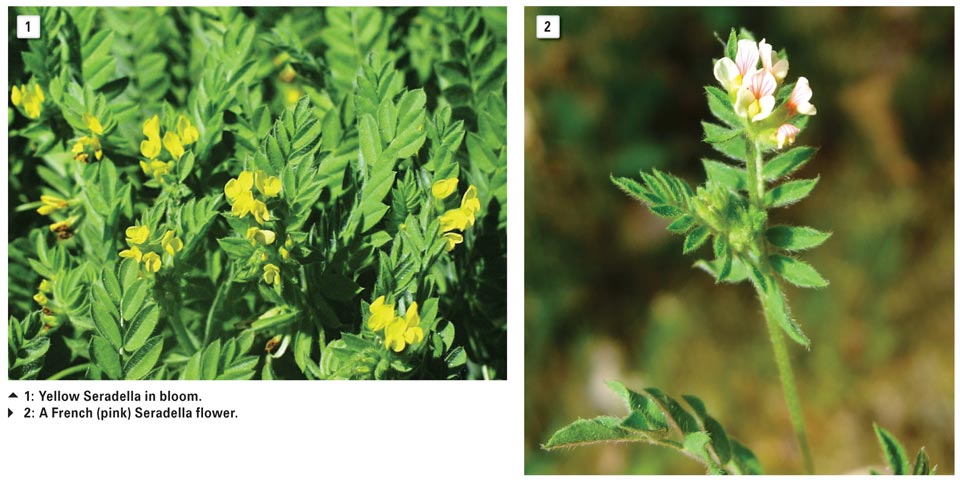
This screenshot has height=484, width=960. I want to click on green plants, so point(153,60), point(459,185), point(391,135), point(116,280), point(80,329), point(390,116), point(395,77), point(327,26).